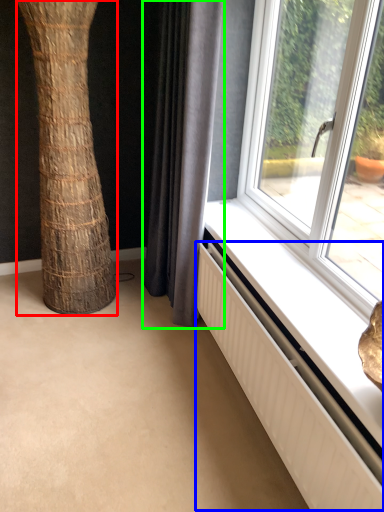
Question: Considering the real-world distances, which object is closest to tree trunk (highlighted by a red box)? radiator (highlighted by a blue box) or curtain (highlighted by a green box).

Choices:
 (A) radiator
 (B) curtain

Answer: (B)